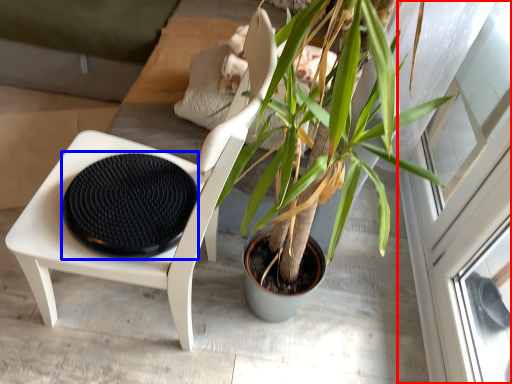
Question: Which point is further to the camera, screen door (highlighted by a red box) or footrest (highlighted by a blue box)?

Choices:
 (A) screen door
 (B) footrest

Answer: (A)